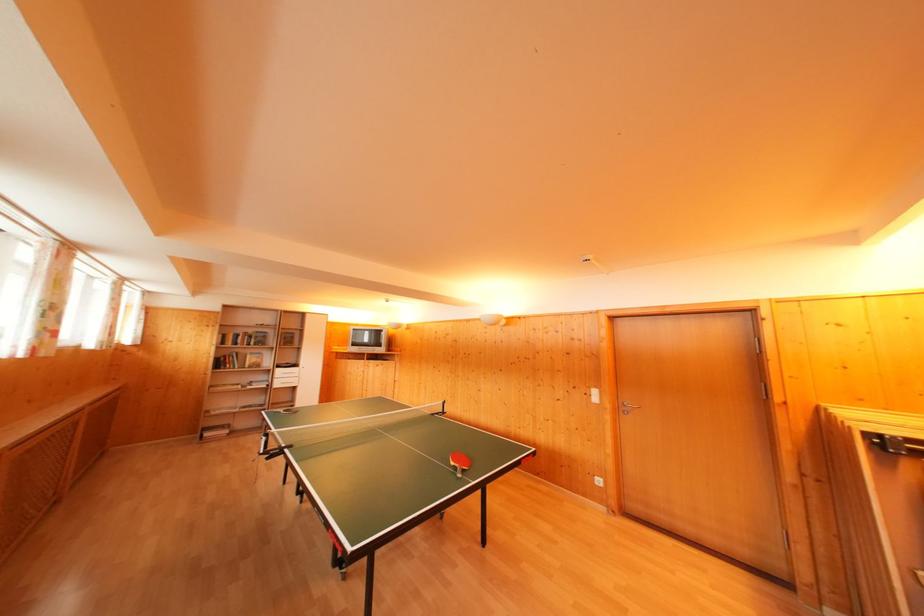
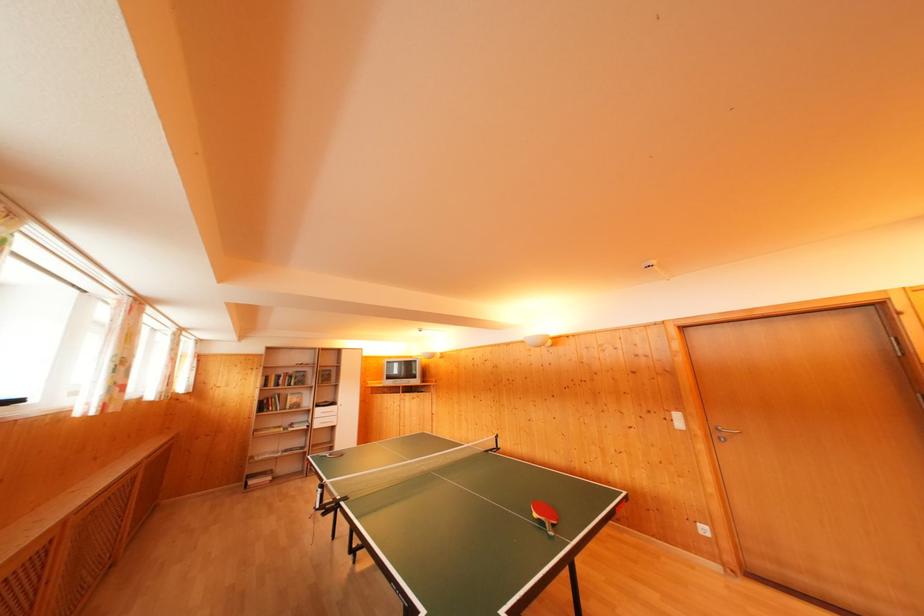
Locate, in the second image, the point that corresponds to point 256,336 in the first image.

(296, 376)